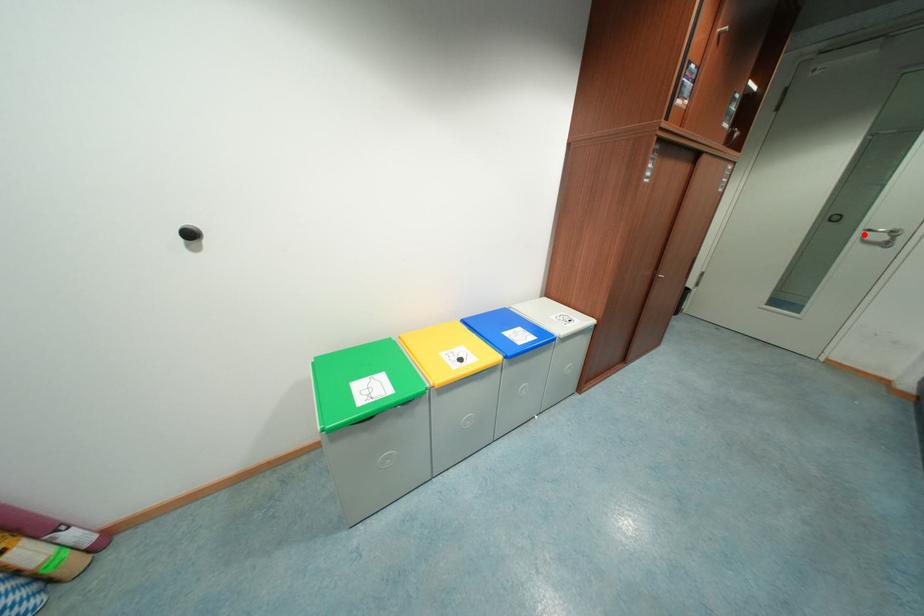
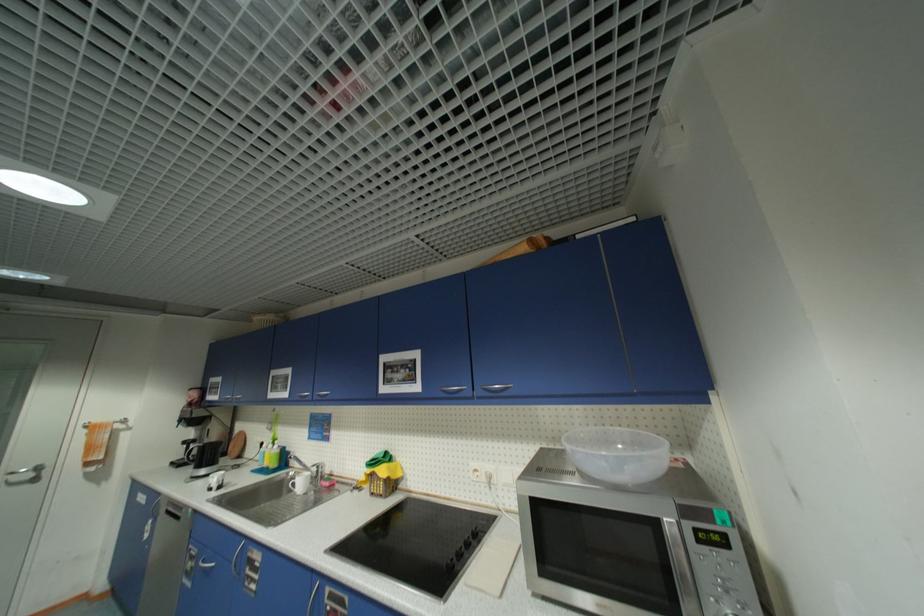
In the second image, find the point that corresponds to the highlighted location in the first image.

(7, 479)